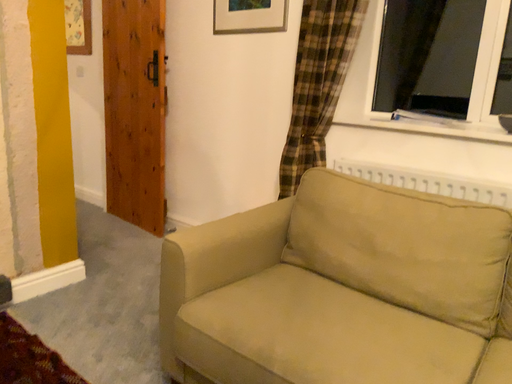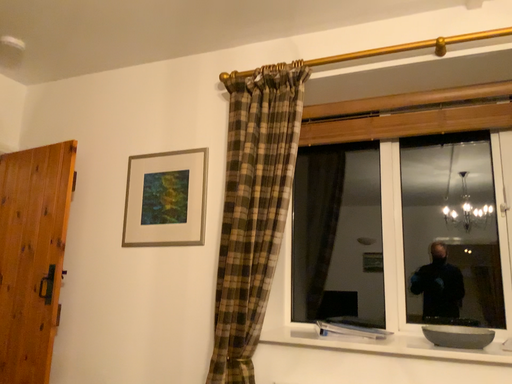
Question: How did the camera likely rotate when shooting the video?

Choices:
 (A) rotated left
 (B) rotated right

Answer: (B)